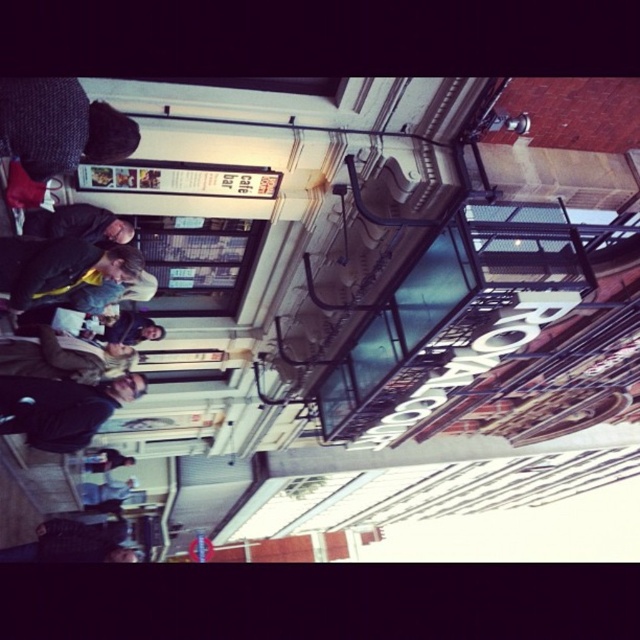
Question: Which point is farther from the camera taking this photo?

Choices:
 (A) (81, 396)
 (B) (65, 113)
 (C) (51, 214)

Answer: (A)

Question: Is knitted dark gray hat at upper left to the left of dark blue jacket at lower left from the viewer's perspective?

Choices:
 (A) yes
 (B) no

Answer: (B)

Question: Is knitted dark gray hat at upper left to the left of dark blue jacket at lower left from the viewer's perspective?

Choices:
 (A) no
 (B) yes

Answer: (A)

Question: Among these points, which one is farthest from the camera?

Choices:
 (A) (22, 230)
 (B) (67, 429)
 (C) (120, 124)

Answer: (B)

Question: Is knitted dark gray hat at upper left thinner than matte black jacket at lower left?

Choices:
 (A) no
 (B) yes

Answer: (B)

Question: Which object is farther from the camera taking this photo?

Choices:
 (A) knitted dark gray hat at upper left
 (B) dark blue jacket at lower left
 (C) matte black jacket at lower left

Answer: (B)